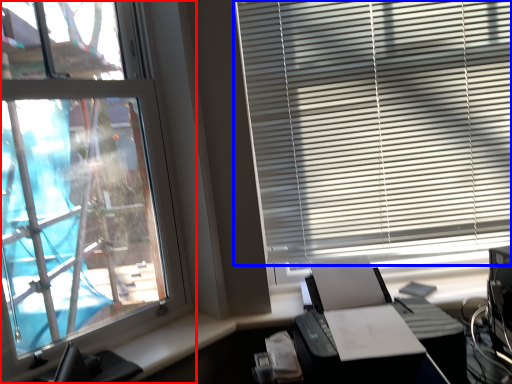
Question: Which object appears farthest to the camera in this image, window (highlighted by a red box) or window blind (highlighted by a blue box)?

Choices:
 (A) window
 (B) window blind

Answer: (B)